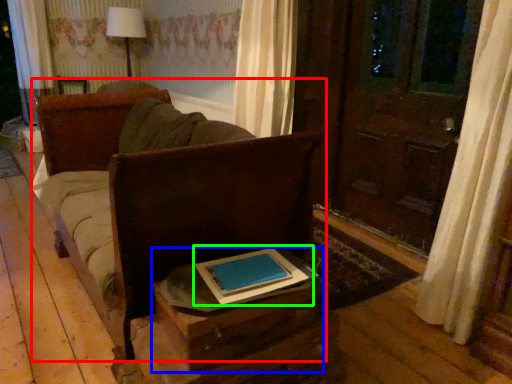
Question: Considering the real-world distances, which object is farthest from furniture (highlighted by a red box)? table (highlighted by a blue box) or book (highlighted by a green box)?

Choices:
 (A) table
 (B) book

Answer: (B)